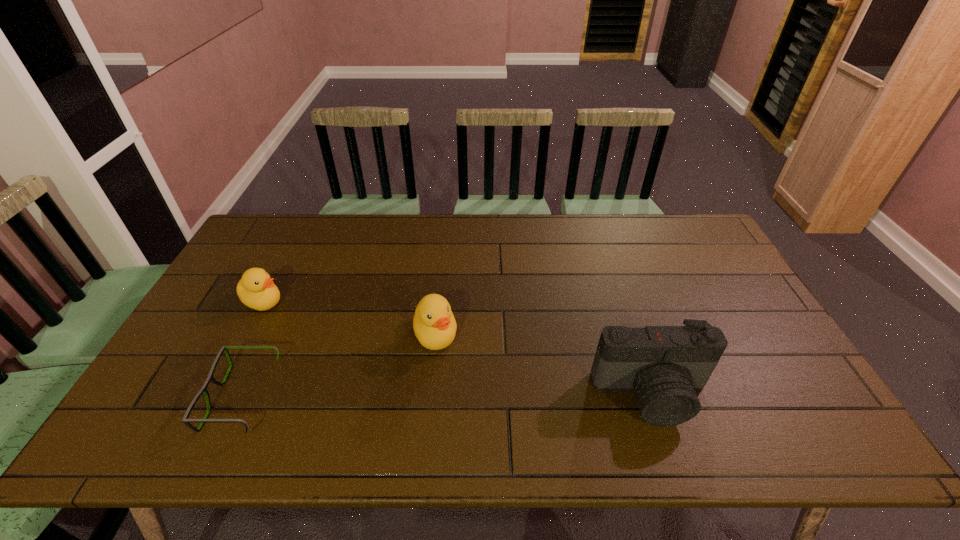
Locate an element on the screen. The height and width of the screenshot is (540, 960). vacant space in between the shortest object and the duck is located at coordinates (339, 366).

This screenshot has width=960, height=540. Identify the location of free area in between the tallest object and the duck. (543, 364).

Locate an element on the screen. The image size is (960, 540). free space that is in between the rightmost object and the shortest object is located at coordinates (447, 396).

Locate which object is the second closest to the second object from right to left. Please provide its 2D coordinates. Your answer should be formatted as a tuple, i.e. [(x, y)], where the tuple contains the x and y coordinates of a point satisfying the conditions above.

[(665, 365)]

You are a GUI agent. You are given a task and a screenshot of the screen. Output one action in this format:
    pyautogui.click(x=<x>, y=<y>)
    Task: Click on the third closest object to the third object from left to right
    This screenshot has width=960, height=540.
    Given the screenshot: What is the action you would take?
    pyautogui.click(x=256, y=289)